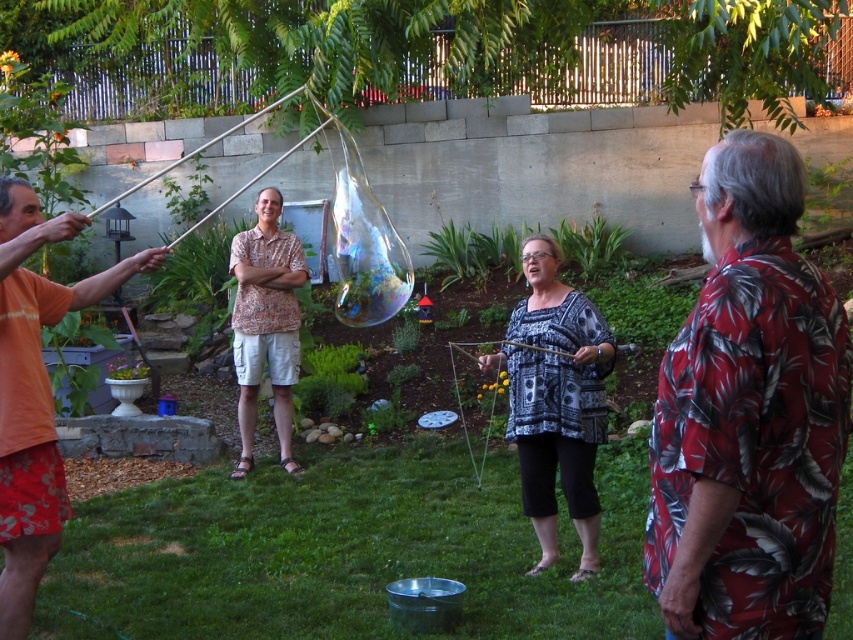
You are a photographer trying to capture a photo of the two people in the scene. The red floral shirt at right and the patterned fabric blouse at center are both in your frame. Which person should you zoom in on to get a clearer image of their clothing details?

You should zoom in on the red floral shirt at right because it has a smaller size compared to the patterned fabric blouse at center, so it might be farther away and require more magnification to capture details.

You are standing at the origin point in the backyard garden scene. There is a red floral shirt at right represented by point (749,413). Can you tell me the direction of the red floral shirt at right from your current position?

The red floral shirt at right is located at coordinates (749,413), which places it to the right and slightly above your current position at the origin point.